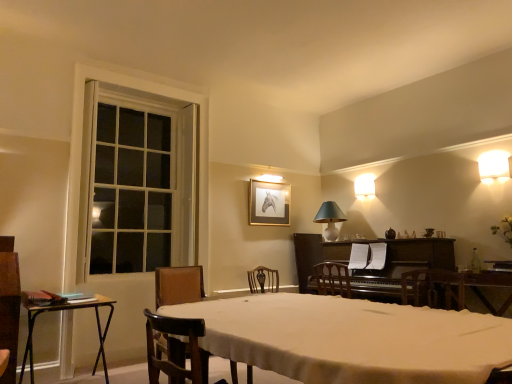
Locate an element on the screen. The width and height of the screenshot is (512, 384). metallic gold picture frame at upper center is located at coordinates (268, 203).

Where is `white ceramic lampshade at upper center, which is the third lamp from top to bottom`? The image size is (512, 384). white ceramic lampshade at upper center, which is the third lamp from top to bottom is located at coordinates (330, 219).

Find the location of a particular element. Image resolution: width=512 pixels, height=384 pixels. metallic black table at left is located at coordinates (67, 310).

Measure the distance between matte white lampshade at upper right, which appears as the 2th lamp when viewed from the top, and camera.

The depth of matte white lampshade at upper right, which appears as the 2th lamp when viewed from the top, is 5.03 meters.

Measure the distance between point (120, 257) and camera.

The depth of point (120, 257) is 14.15 feet.

Locate an element on the screen. This screenshot has height=384, width=512. metallic gold picture frame at upper center is located at coordinates (268, 203).

Who is more distant, brown leather chair at lower left or wooden table at center?

brown leather chair at lower left is further from the camera.

Where is `desk in front of the brown leather chair at lower left`? This screenshot has width=512, height=384. desk in front of the brown leather chair at lower left is located at coordinates tap(351, 339).

Is brown leather chair at lower left outside of wooden table at center?

Yes, brown leather chair at lower left is located beyond the bounds of wooden table at center.

Which is more to the left, metallic gold picture frame at upper center or metallic black table at left?

metallic black table at left is more to the left.

Which object is thinner, metallic gold picture frame at upper center or metallic black table at left?

With smaller width is metallic gold picture frame at upper center.

Is metallic gold picture frame at upper center oriented towards metallic black table at left?

No, metallic gold picture frame at upper center is not oriented towards metallic black table at left.

Can you confirm if metallic gold picture frame at upper center is taller than metallic black table at left?

No, metallic gold picture frame at upper center is not taller than metallic black table at left.

Consider the image. Can you confirm if matte white lampshade at upper right, the third lamp from the front, is wider than dark polished wood piano at center-right?

Incorrect, the width of matte white lampshade at upper right, the third lamp from the front, does not surpass that of dark polished wood piano at center-right.

Which point is more distant from viewer, (368, 183) or (392, 258)?

Point (368, 183)

You are a GUI agent. You are given a task and a screenshot of the screen. Output one action in this format:
    pyautogui.click(x=<x>, y=<y>)
    Task: Click on the piano that is in front of the matte white lampshade at upper right, positioned as the first lamp in back-to-front order
    This screenshot has width=512, height=384.
    Given the screenshot: What is the action you would take?
    pyautogui.click(x=402, y=267)

Would you say matte white lampshade at upper right, which appears as the 2th lamp when viewed from the top, is inside or outside dark polished wood piano at center-right?

matte white lampshade at upper right, which appears as the 2th lamp when viewed from the top, is located beyond the bounds of dark polished wood piano at center-right.

Between metallic gold picture frame at upper center and wooden table at center, which one has larger size?

wooden table at center is bigger.

Does metallic gold picture frame at upper center have a greater height compared to wooden table at center?

Incorrect, the height of metallic gold picture frame at upper center is not larger of that of wooden table at center.

Is wooden table at center at the back of metallic gold picture frame at upper center?

No, metallic gold picture frame at upper center is not facing away from wooden table at center.

How different are the orientations of metallic gold picture frame at upper center and wooden table at center in degrees?

The facing directions of metallic gold picture frame at upper center and wooden table at center are 89.6 degrees apart.

From a real-world perspective, relative to white ceramic lampshade at upper center, which appears as the 1th lamp when ordered from the bottom, is dark polished wood piano at center-right vertically above or below?

dark polished wood piano at center-right is situated lower than white ceramic lampshade at upper center, which appears as the 1th lamp when ordered from the bottom, in the real world.

Is dark polished wood piano at center-right positioned with its back to white ceramic lampshade at upper center, which appears as the 1th lamp when ordered from the bottom?

dark polished wood piano at center-right is not turned away from white ceramic lampshade at upper center, which appears as the 1th lamp when ordered from the bottom.

Is white ceramic lampshade at upper center, which appears as the 1th lamp when ordered from the bottom, a part of dark polished wood piano at center-right?

Actually, white ceramic lampshade at upper center, which appears as the 1th lamp when ordered from the bottom, is outside dark polished wood piano at center-right.

Measure the distance between dark polished wood piano at center-right and white ceramic lampshade at upper center, which appears as the 2th lamp when viewed from the back.

dark polished wood piano at center-right is 37.42 inches away from white ceramic lampshade at upper center, which appears as the 2th lamp when viewed from the back.

Is the surface of white glossy wall sconce at upper right, the first lamp viewed from the top, in direct contact with clear glass bottle at right?

No, white glossy wall sconce at upper right, the first lamp viewed from the top, is not touching clear glass bottle at right.

Does white glossy wall sconce at upper right, which appears as the first lamp when viewed from the right, appear on the left side of clear glass bottle at right?

No, white glossy wall sconce at upper right, which appears as the first lamp when viewed from the right, is not to the left of clear glass bottle at right.

Which of these two, white glossy wall sconce at upper right, the first lamp viewed from the top, or clear glass bottle at right, is wider?

Wider between the two is white glossy wall sconce at upper right, the first lamp viewed from the top.

How different are the orientations of white glossy wall sconce at upper right, the 3th lamp in the left-to-right sequence, and clear glass bottle at right in degrees?

The angular difference between white glossy wall sconce at upper right, the 3th lamp in the left-to-right sequence, and clear glass bottle at right is 0.00607 degrees.

From the image's perspective, who appears lower, matte white lampshade at upper right, positioned as the first lamp in back-to-front order, or metallic gold picture frame at upper center?

metallic gold picture frame at upper center appears lower in the image.

What's the angular difference between matte white lampshade at upper right, the second lamp from the bottom, and metallic gold picture frame at upper center's facing directions?

They differ by 88.8 degrees in their facing directions.

From a real-world perspective, does matte white lampshade at upper right, the third lamp from the front, sit lower than metallic gold picture frame at upper center?

No.

You are a GUI agent. You are given a task and a screenshot of the screen. Output one action in this format:
    pyautogui.click(x=<x>, y=<y>)
    Task: Click on the chair above the wooden table at center (from a real-world perspective)
    
    Given the screenshot: What is the action you would take?
    pyautogui.click(x=178, y=285)

Image resolution: width=512 pixels, height=384 pixels. What are the coordinates of `picture frame behind the metallic black table at left` in the screenshot? It's located at (268, 203).

Considering their positions, is brown leather chair at lower left positioned closer to matte white lampshade at upper right, which appears as the 2th lamp when viewed from the top, than dark polished wood piano at center-right?

Based on the image, dark polished wood piano at center-right appears to be nearer to matte white lampshade at upper right, which appears as the 2th lamp when viewed from the top.

Estimate the real-world distances between objects in this image. Which object is closer to dark polished wood piano at center-right, white ceramic lampshade at upper center, acting as the third lamp starting from the right, or metallic black table at left?

white ceramic lampshade at upper center, acting as the third lamp starting from the right, lies closer to dark polished wood piano at center-right than the other object.

Consider the image. Considering their positions, is metallic black table at left positioned further to white ceramic lampshade at upper center, which is the third lamp from top to bottom, than wooden table at center?

The object further to white ceramic lampshade at upper center, which is the third lamp from top to bottom, is wooden table at center.

Which object lies further to the anchor point dark polished wood piano at center-right, metallic gold picture frame at upper center or white wood window at left?

white wood window at left.

Consider the image. When comparing their distances from clear glass bottle at right, does white ceramic lampshade at upper center, which appears as the 2th lamp when viewed from the back, or dark polished wood piano at center-right seem closer?

dark polished wood piano at center-right.

When comparing their distances from wooden table at center, does dark polished wood piano at center-right or metallic black table at left seem further?

metallic black table at left.

Considering their positions, is wooden table at center positioned further to brown leather chair at lower left than clear glass bottle at right?

The object further to brown leather chair at lower left is clear glass bottle at right.

Looking at the image, which one is located closer to matte white lampshade at upper right, which appears as the 2th lamp when viewed from the top, brown leather chair at lower left or clear glass bottle at right?

clear glass bottle at right lies closer to matte white lampshade at upper right, which appears as the 2th lamp when viewed from the top, than the other object.

I want to click on chair positioned between wooden table at center and matte white lampshade at upper right, the second lamp from the bottom, from near to far, so click(x=178, y=285).

Locate an element on the screen. lamp located between white ceramic lampshade at upper center, acting as the third lamp starting from the right, and white glossy wall sconce at upper right, which is the 3th lamp from back to front, in the left-right direction is located at coordinates (365, 187).

Identify the location of bottle between white wood window at left and white glossy wall sconce at upper right, the third lamp positioned from the bottom, in the horizontal direction. The height and width of the screenshot is (384, 512). (475, 262).

Locate an element on the screen. chair situated between white wood window at left and white glossy wall sconce at upper right, which appears as the first lamp when viewed from the right, from left to right is located at coordinates (178, 285).